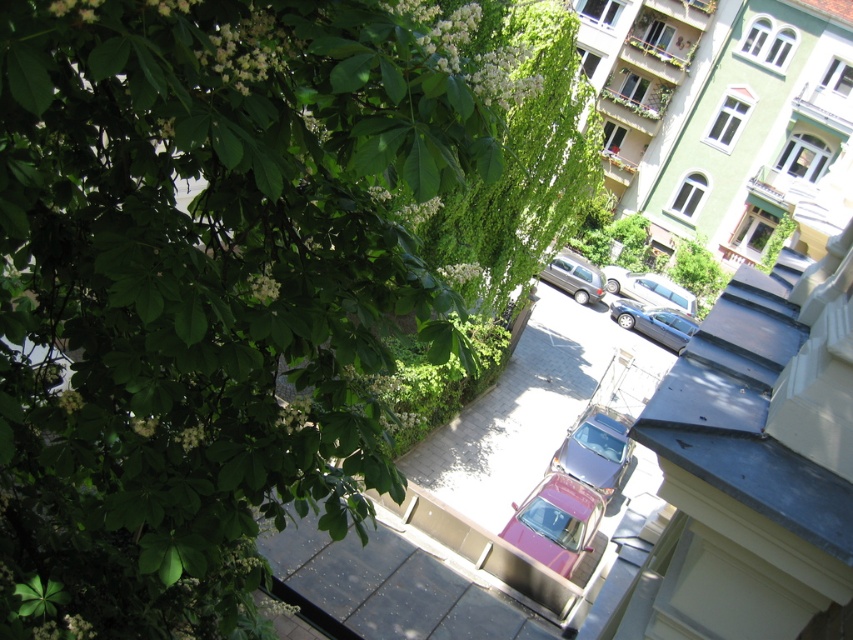
Question: Which object is positioned farthest from the satin silver van at center?

Choices:
 (A) shiny red car at center
 (B) metallic silver car at center

Answer: (A)

Question: From the image, what is the correct spatial relationship of green leafy tree at upper left in relation to metallic silver car at center?

Choices:
 (A) left
 (B) right

Answer: (A)

Question: Is green leafy tree at upper left positioned before shiny red car at center?

Choices:
 (A) yes
 (B) no

Answer: (A)

Question: Which point is farther to the camera?

Choices:
 (A) metallic silver sedan at center
 (B) shiny red car at center
 (C) satin silver van at center

Answer: (C)

Question: Which is nearer to the metallic silver sedan at center?

Choices:
 (A) green leafy tree at upper left
 (B) metallic gray alley at center
 (C) metallic silver car at center

Answer: (B)

Question: Where is shiny red car at center located in relation to metallic silver sedan at center in the image?

Choices:
 (A) below
 (B) above

Answer: (A)